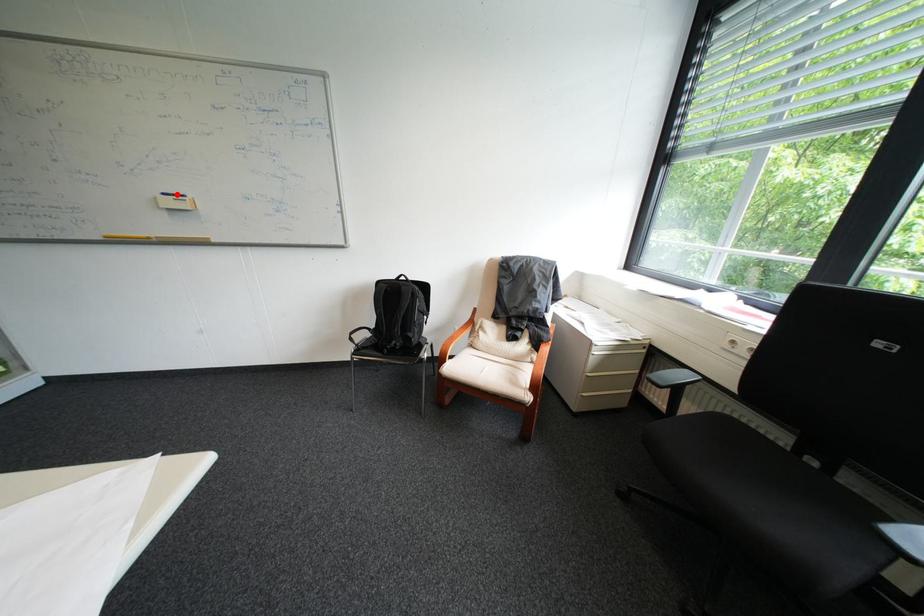
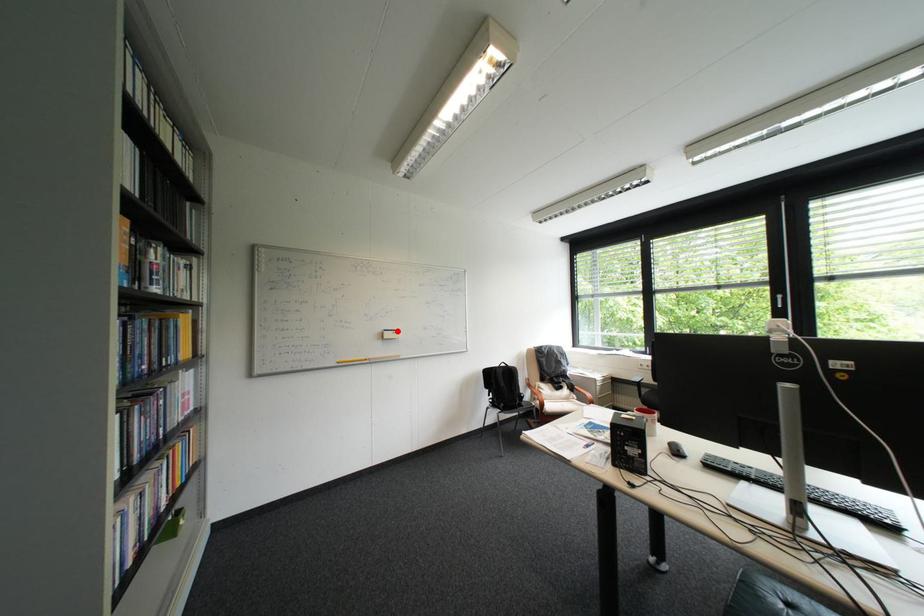
I am providing you with two images of the same scene from different viewpoints. A red point is marked on the first image and another point is marked on the second image. Do the highlighted points in image1 and image2 indicate the same real-world spot?

Yes